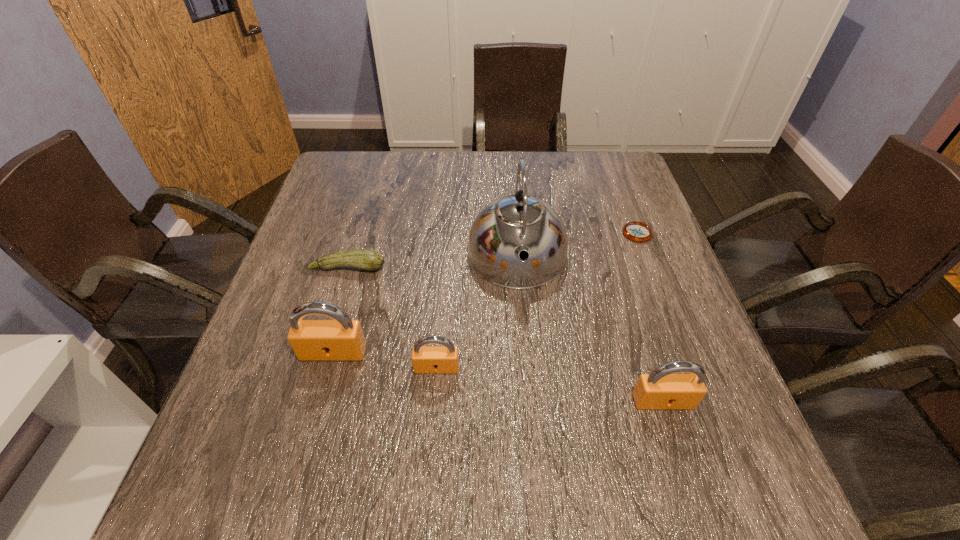
If the aim is uniform spacing by inserting an additional padlock among them, please point to a vacant space for this new padlock. Please provide its 2D coordinates. Your answer should be formatted as a tuple, i.e. [(x, y)], where the tuple contains the x and y coordinates of a point satisfying the conditions above.

[(546, 384)]